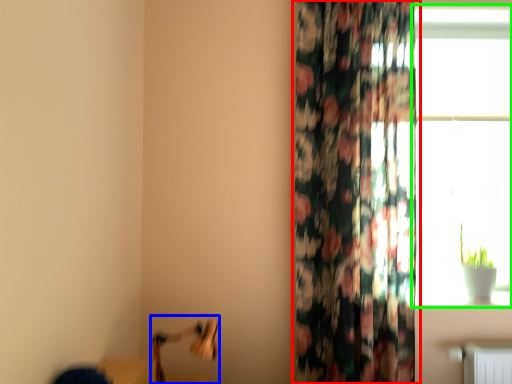
Question: Estimate the real-world distances between objects in this image. Which object is farther from curtain (highlighted by a red box), swivel chair (highlighted by a blue box) or window (highlighted by a green box)?

Choices:
 (A) swivel chair
 (B) window

Answer: (A)